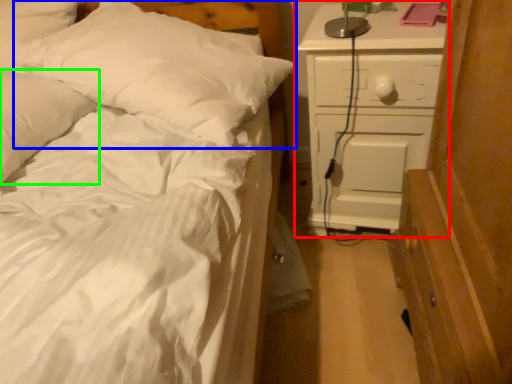
Question: Considering the real-world distances, which object is closest to chest of drawers (highlighted by a red box)? pillow (highlighted by a blue box) or pillow (highlighted by a green box).

Choices:
 (A) pillow
 (B) pillow

Answer: (A)